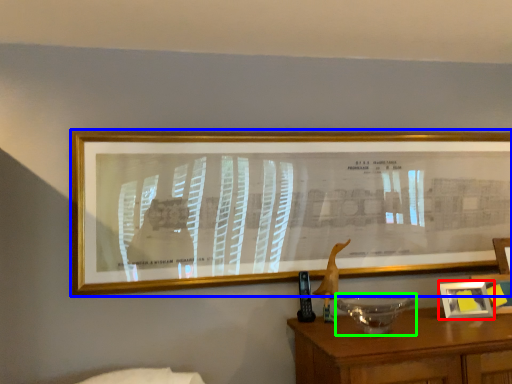
Question: Estimate the real-world distances between objects in this image. Which object is farther from picture frame (highlighted by a red box), picture frame (highlighted by a blue box) or glass bowl (highlighted by a green box)?

Choices:
 (A) picture frame
 (B) glass bowl

Answer: (A)